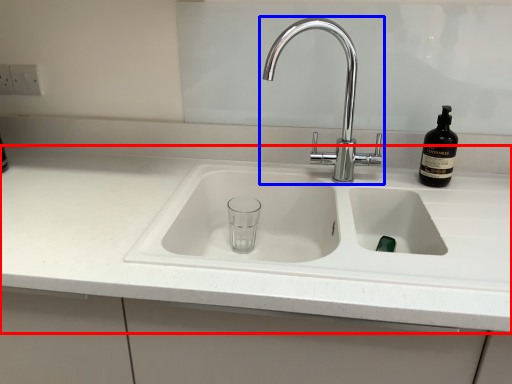
Question: Which of the following is the farthest to the observer, countertop (highlighted by a red box) or tap (highlighted by a blue box)?

Choices:
 (A) countertop
 (B) tap

Answer: (B)